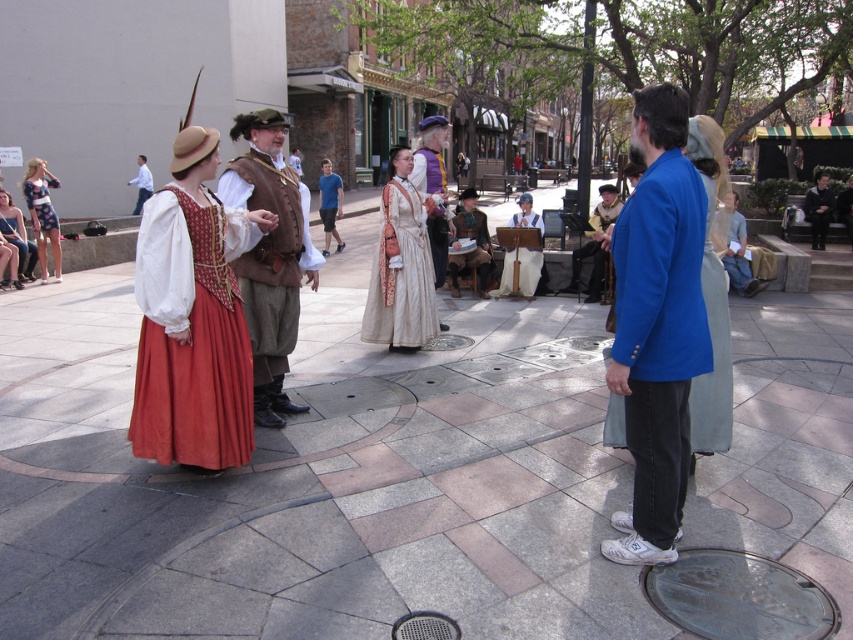
From the picture: You are a tailor observing the printed cotton dress at left and the white cotton shirt at upper left. Which garment would require more fabric to make?

The printed cotton dress at left requires more fabric because it has a larger size than the white cotton shirt at upper left.

You are a photographer standing in the plaza and want to take a picture of the bronze textured manhole cover at center and the printed cotton dress at left. Which object is closer to you?

The bronze textured manhole cover at center is closer to you because it is in front of the printed cotton dress at left.